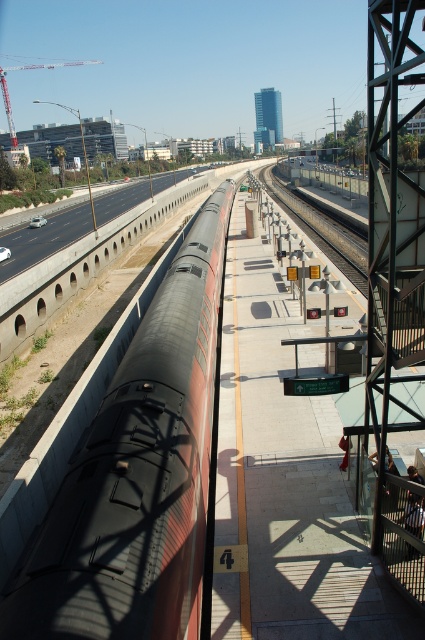
You are a passenger standing on the platform and looking towards the black asphalt highway at left and the black metal train track at center. Which object appears taller in the scene?

The black asphalt highway at left appears taller than the black metal train track at center in the scene.

You are a passenger waiting at the train station. You notice the matte black train at center and the black asphalt highway at left. Which of these two objects is smaller in size?

The matte black train at center is smaller in size compared to the black asphalt highway at left according to the description.

You are standing at the train station platform and want to reach a specific point marked at coordinates point (82, 230). If you can walk at a speed of 1.5 meters per second, how many seconds will it take you to reach that point?

The distance between you and the point (82, 230) is 52.74 meters. At a walking speed of 1.5 meters per second, it will take approximately 35.16 seconds to reach the point.